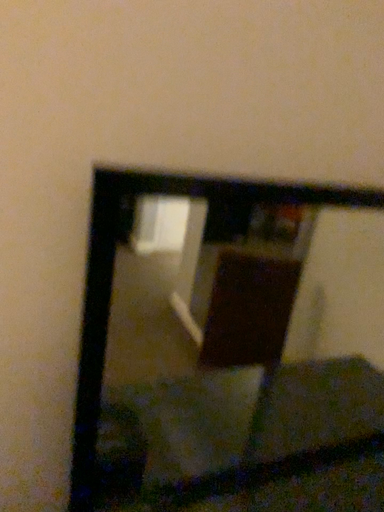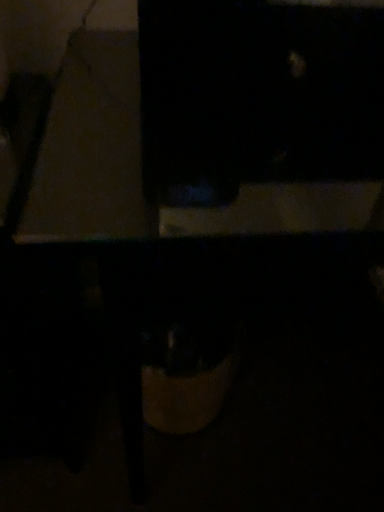
Question: Which way did the camera rotate in the video?

Choices:
 (A) rotated right
 (B) rotated left

Answer: (B)